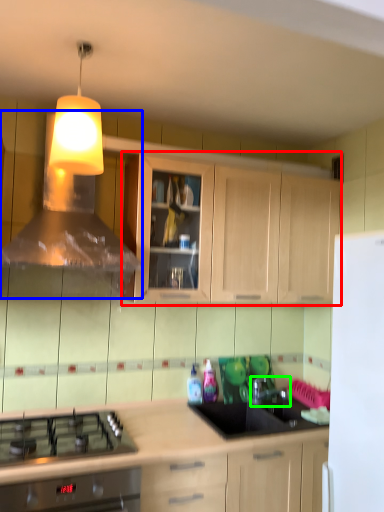
Question: Estimate the real-world distances between objects in this image. Which object is farther from cabinetry (highlighted by a red box), vent (highlighted by a blue box) or tap (highlighted by a green box)?

Choices:
 (A) vent
 (B) tap

Answer: (B)